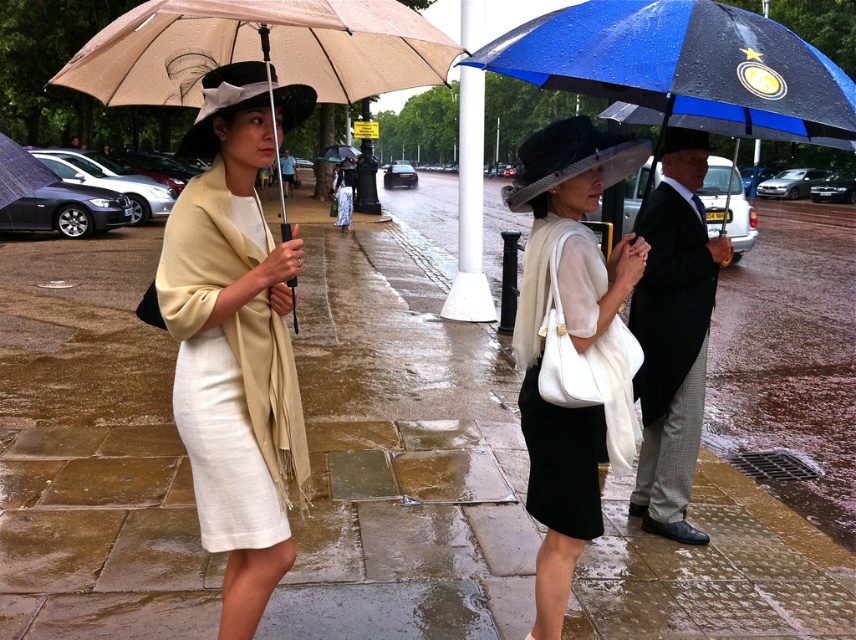
Question: Is wet stone pavement at center above matte beige dress at center?

Choices:
 (A) yes
 (B) no

Answer: (A)

Question: Is matte white dress at center smaller than black wool suit at right?

Choices:
 (A) yes
 (B) no

Answer: (A)

Question: Among these points, which one is farthest from the camera?

Choices:
 (A) (293, 45)
 (B) (6, 186)
 (C) (596, 16)
 (D) (655, 380)

Answer: (D)

Question: Which of these objects is positioned closest to the beige fabric umbrella at left?

Choices:
 (A) blue fabric umbrella at upper right
 (B) wet stone pavement at center

Answer: (A)

Question: Which of the following is the closest to the observer?

Choices:
 (A) (16, 195)
 (B) (572, 500)
 (C) (441, 472)
 (D) (265, 45)

Answer: (D)

Question: Can you confirm if matte beige dress at center is positioned to the left of blue fabric umbrella at upper right?

Choices:
 (A) yes
 (B) no

Answer: (A)